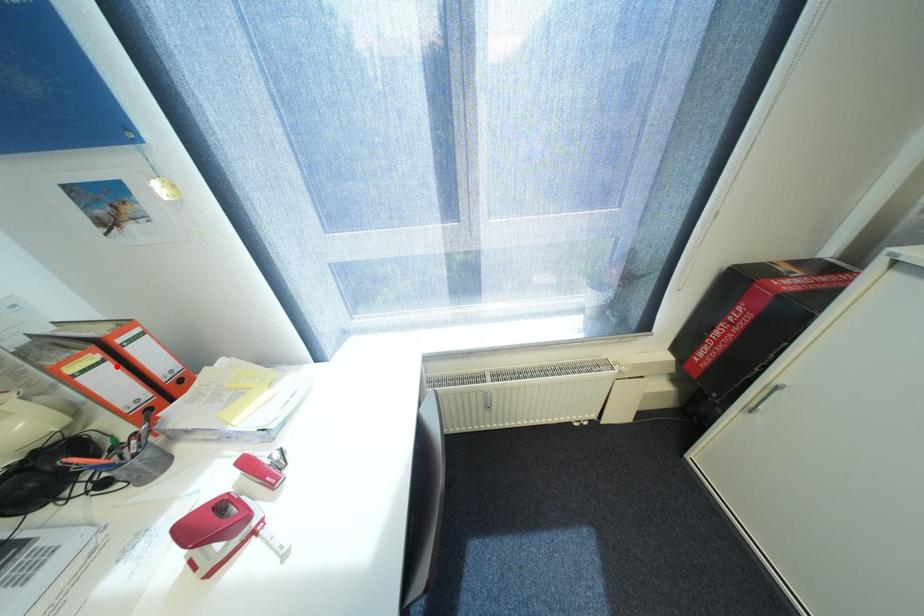
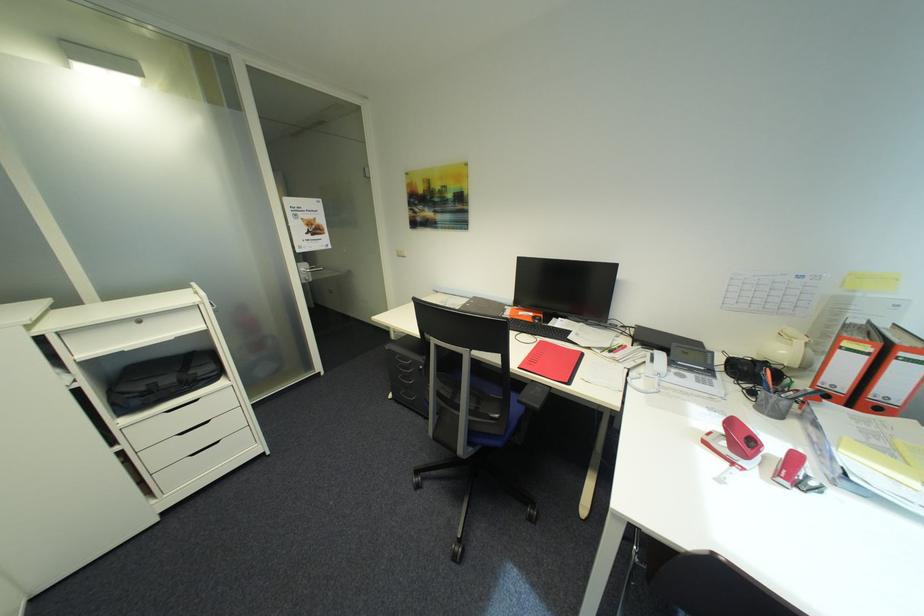
The point at the highlighted location is marked in the first image. Where is the corresponding point in the second image?

(872, 359)